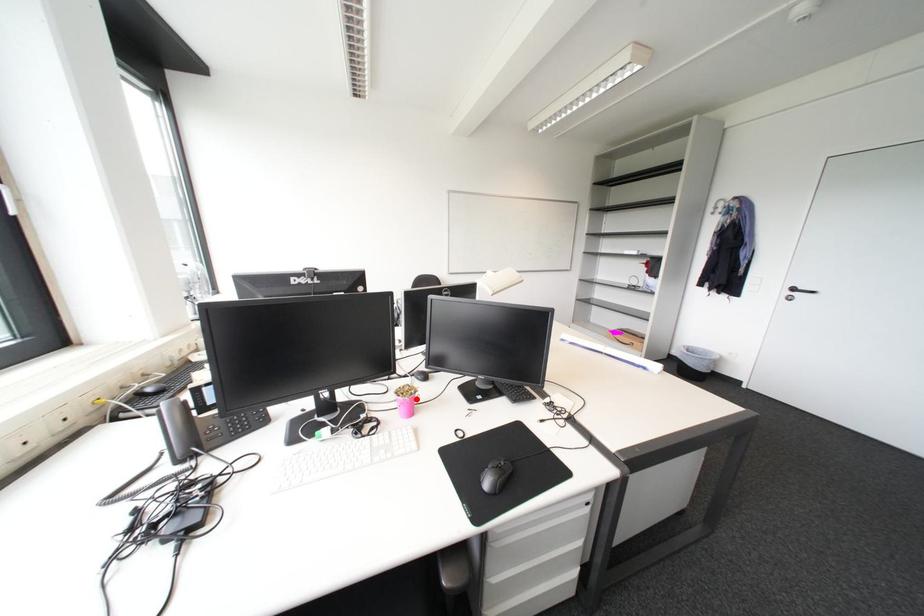
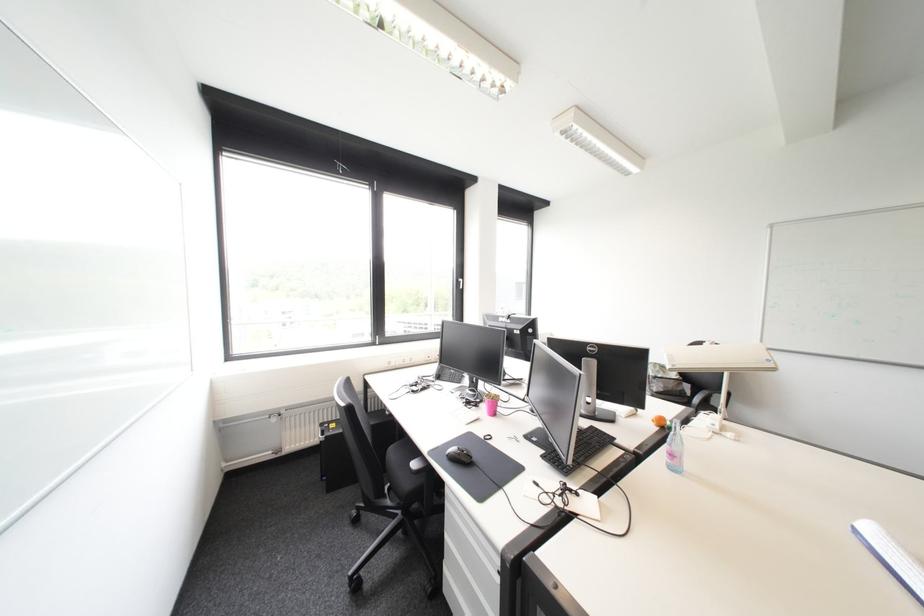
The point at the highlighted location is marked in the first image. Where is the corresponding point in the second image?

(495, 400)